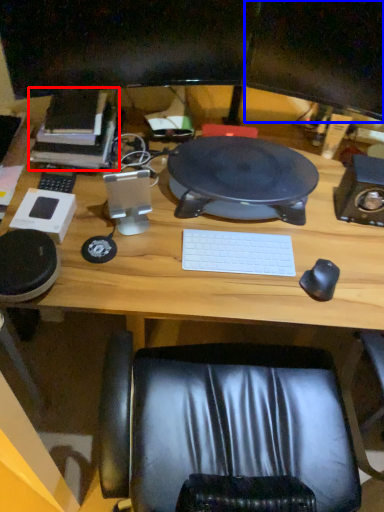
Question: Among these objects, which one is farthest to the camera, book (highlighted by a red box) or computer monitor (highlighted by a blue box)?

Choices:
 (A) book
 (B) computer monitor

Answer: (A)